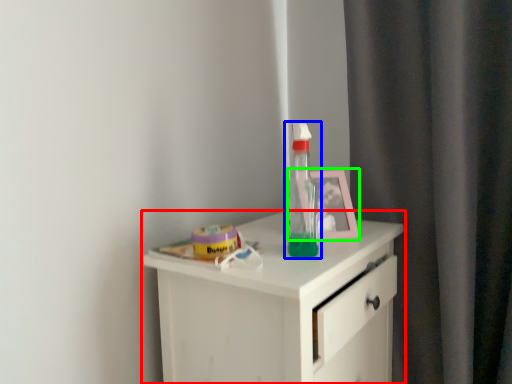
Question: Estimate the real-world distances between objects in this image. Which object is farther from chest of drawers (highlighted by a red box), bottle (highlighted by a blue box) or picture frame (highlighted by a green box)?

Choices:
 (A) bottle
 (B) picture frame

Answer: (B)